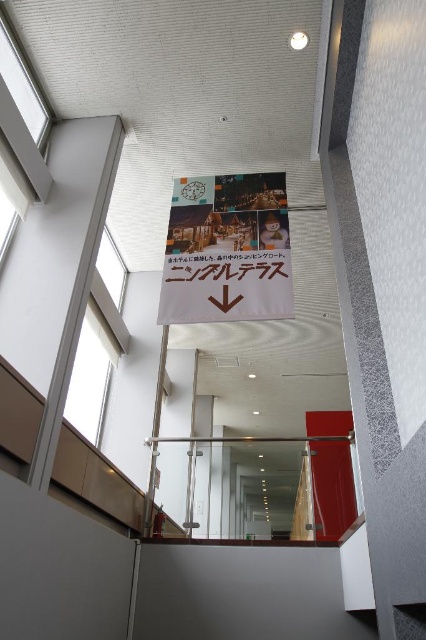
Question: Observing the image, what is the correct spatial positioning of matte paper poster at center in reference to transparent glass window at upper left?

Choices:
 (A) below
 (B) above

Answer: (B)

Question: Which of the following is the closest to the observer?

Choices:
 (A) (11, 74)
 (B) (259, 195)
 (C) (120, 273)
 (D) (92, 342)

Answer: (A)

Question: Which of the following is the closest to the observer?

Choices:
 (A) matte paper poster at center
 (B) clear glass window at upper left

Answer: (B)

Question: Which point is closer to the camera taking this photo?

Choices:
 (A) (39, 134)
 (B) (178, 211)
 (C) (111, 298)

Answer: (A)

Question: Is transparent glass window at upper left smaller than clear glass window at upper left?

Choices:
 (A) yes
 (B) no

Answer: (B)

Question: Does matte paper poster at center come behind clear glass window at upper left?

Choices:
 (A) yes
 (B) no

Answer: (A)